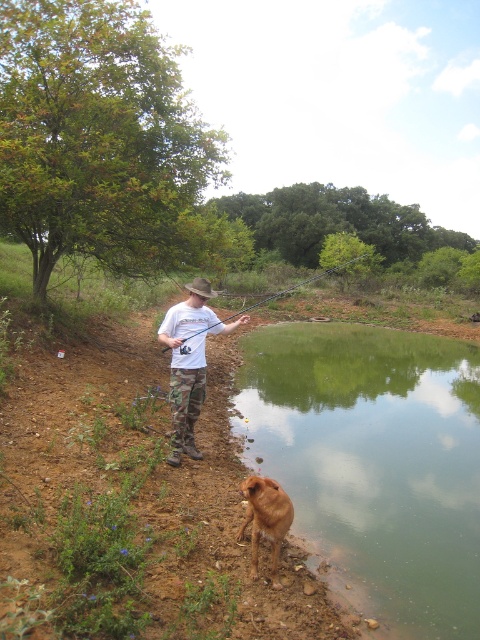
Between point (286, 496) and point (204, 280), which one is positioned in front?

Point (286, 496)

Can you confirm if brown furry dog at lower center is taller than brown woven cowboy hat at center?

No, brown furry dog at lower center is not taller than brown woven cowboy hat at center.

Identify the location of brown furry dog at lower center. (265, 518).

At what (x,y) coordinates should I click in order to perform the action: click on brown furry dog at lower center. Please return your answer as a coordinate pair (x, y). Looking at the image, I should click on (265, 518).

Which of these two, black rod at center or brown woven cowboy hat at center, stands taller?

With more height is black rod at center.

Is black rod at center below brown woven cowboy hat at center?

Actually, black rod at center is above brown woven cowboy hat at center.

Between point (312, 276) and point (202, 296), which one is positioned behind?

Positioned behind is point (312, 276).

Where is `black rod at center`? This screenshot has height=640, width=480. black rod at center is located at coordinates (300, 284).

Which is above, white matte shirt at center or brown furry dog at lower center?

white matte shirt at center

Where is `white matte shirt at center`? white matte shirt at center is located at coordinates [x=189, y=365].